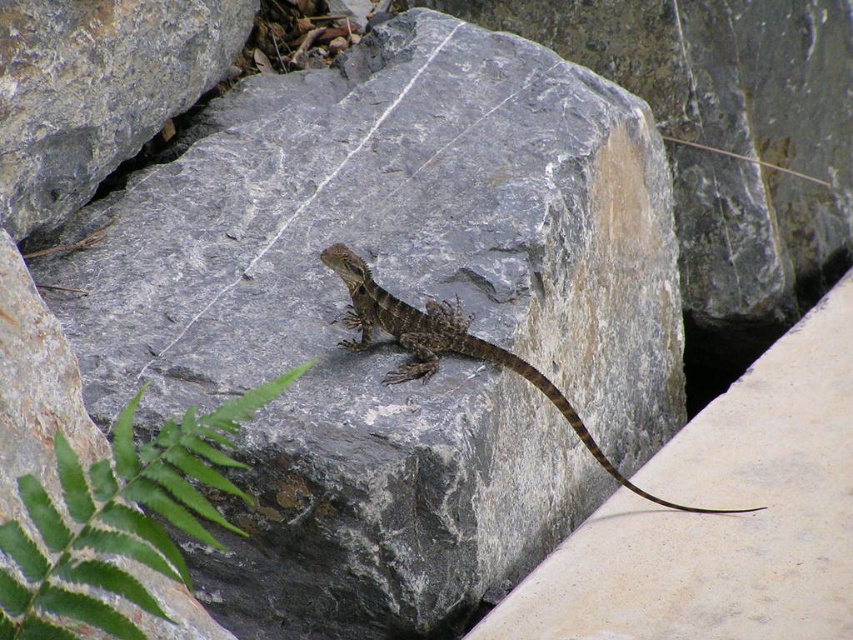
In the scene shown: You are a photographer trying to capture the brown scaly lizard at center. You notice the gray rough rock at center is in the way. Can you move the rock to get a clear shot of the lizard?

The gray rough rock at center is much taller than the brown scaly lizard at center, so moving the rock might not be feasible as it is a large object and could harm the lizard or its habitat.

You are a photographer trying to capture the lizard on the rock. You notice two points in the scene marked as point 1 at coordinates point (67, 524) and point 2 at coordinates point (456, 316). Which point is closer to your camera lens?

Point (67, 524) is closer to the camera than point (456, 316).

You are standing at the center of the image. Which direction should you move to reach the green leafy fern at lower left?

The green leafy fern at lower left is located at coordinates point (119, 518). Since you are at the center, you should move towards the lower left direction to reach it.